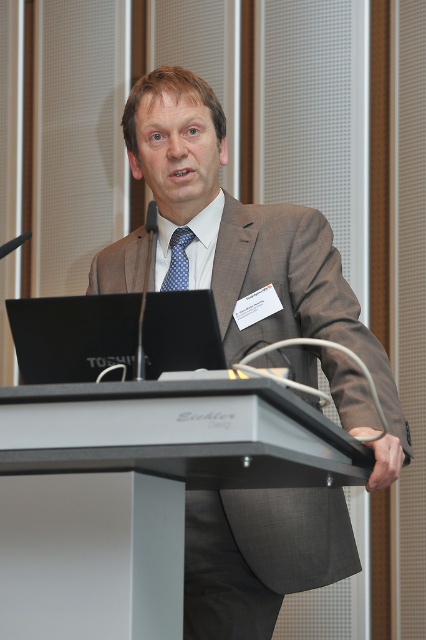
Between metallic gray podium at center and black glossy laptop at center, which one appears on the right side from the viewer's perspective?

Positioned to the right is metallic gray podium at center.

What do you see at coordinates (176, 433) in the screenshot? I see `metallic gray podium at center` at bounding box center [176, 433].

The height and width of the screenshot is (640, 426). I want to click on metallic gray podium at center, so click(176, 433).

Who is positioned more to the left, matte gray suit at center or metallic gray podium at center?

Positioned to the left is metallic gray podium at center.

Locate an element on the screen. matte gray suit at center is located at coordinates (249, 241).

This screenshot has height=640, width=426. I want to click on matte gray suit at center, so click(249, 241).

Does black glossy laptop at center appear on the right side of blue silk tie at center?

In fact, black glossy laptop at center is to the left of blue silk tie at center.

Does point (103, 326) come closer to viewer compared to point (181, 275)?

Yes.

The height and width of the screenshot is (640, 426). Describe the element at coordinates (74, 336) in the screenshot. I see `black glossy laptop at center` at that location.

Where is `black glossy laptop at center`? The image size is (426, 640). black glossy laptop at center is located at coordinates (74, 336).